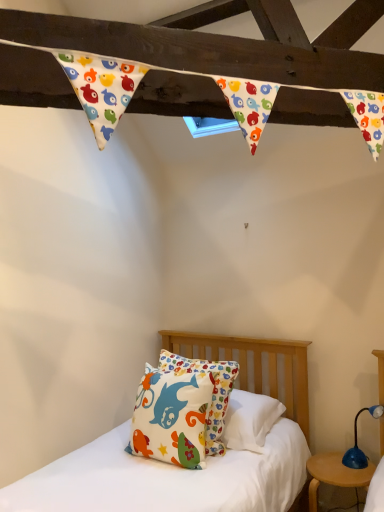
Question: From their relative heights in the image, would you say blue plastic table lamp at lower right is taller or shorter than matte cotton pillow at center?

Choices:
 (A) short
 (B) tall

Answer: (A)

Question: From a real-world perspective, is blue plastic table lamp at lower right above or below matte cotton pillow at center?

Choices:
 (A) below
 (B) above

Answer: (A)

Question: Which is farther from the blue plastic table lamp at lower right?

Choices:
 (A) matte cotton pillow at center
 (B) wooden round table at lower right

Answer: (A)

Question: Which object is positioned closest to the wooden round table at lower right?

Choices:
 (A) blue plastic table lamp at lower right
 (B) matte cotton pillow at center

Answer: (A)